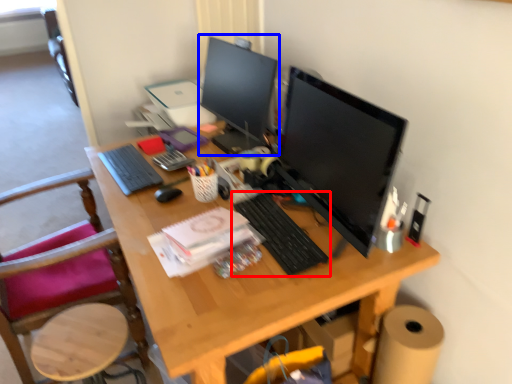
Question: Which object is closer to the camera taking this photo, computer keyboard (highlighted by a red box) or computer monitor (highlighted by a blue box)?

Choices:
 (A) computer keyboard
 (B) computer monitor

Answer: (A)